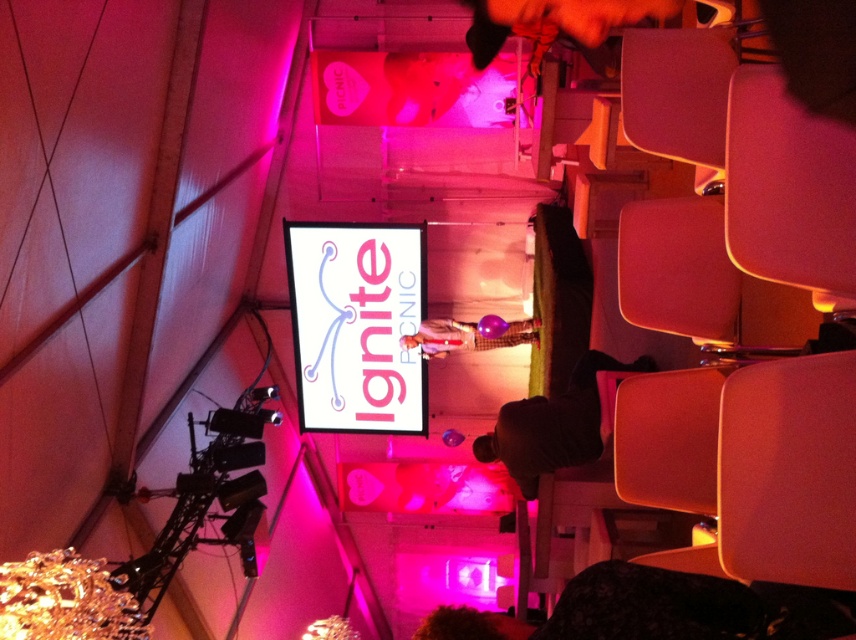
Question: Can you confirm if white plastic sign at center is positioned to the right of dark brown leather jacket at lower center?

Choices:
 (A) yes
 (B) no

Answer: (B)

Question: Is white plastic sign at center above dark brown leather jacket at lower center?

Choices:
 (A) no
 (B) yes

Answer: (B)

Question: Estimate the real-world distances between objects in this image. Which object is closer to the matte purple balloon at center?

Choices:
 (A) white plastic sign at center
 (B) dark brown leather jacket at lower center

Answer: (A)

Question: Among these objects, which one is nearest to the camera?

Choices:
 (A) white plastic sign at center
 (B) dark brown leather jacket at lower center
 (C) matte purple balloon at center

Answer: (B)

Question: Which object is closer to the camera taking this photo?

Choices:
 (A) white plastic sign at center
 (B) matte purple balloon at center

Answer: (B)

Question: Is white plastic sign at center closer to the viewer compared to dark brown leather jacket at lower center?

Choices:
 (A) no
 (B) yes

Answer: (A)